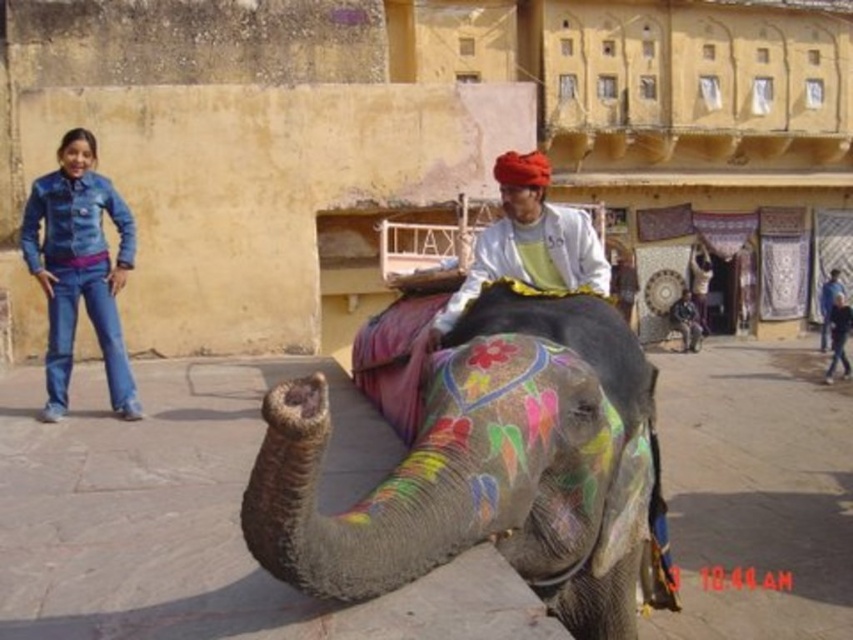
You are standing at the entrance of the historical site and see the painted fabric elephant at center. If you walk straight ahead, will you reach the elephant before the building behind it?

The painted fabric elephant at center is located at point (489, 468), which is closer to you than the building behind it. Therefore, you will reach the elephant before the building.

You are standing at the point with coordinates point (543,173) and want to move to the point with coordinates point (387,579). Is the point you want to reach located in front of your current position?

Yes, the point (387,579) is in front of point (543,173), so the desired location is indeed in front of your current position.

You are a photographer trying to capture a photo of the denim jeans at left and the matte white shirt at center. Since you want to ensure both are in focus, you need to know which one is taller. Can you tell me which object is taller?

The denim jeans at left is much taller than the matte white shirt at center according to the description.